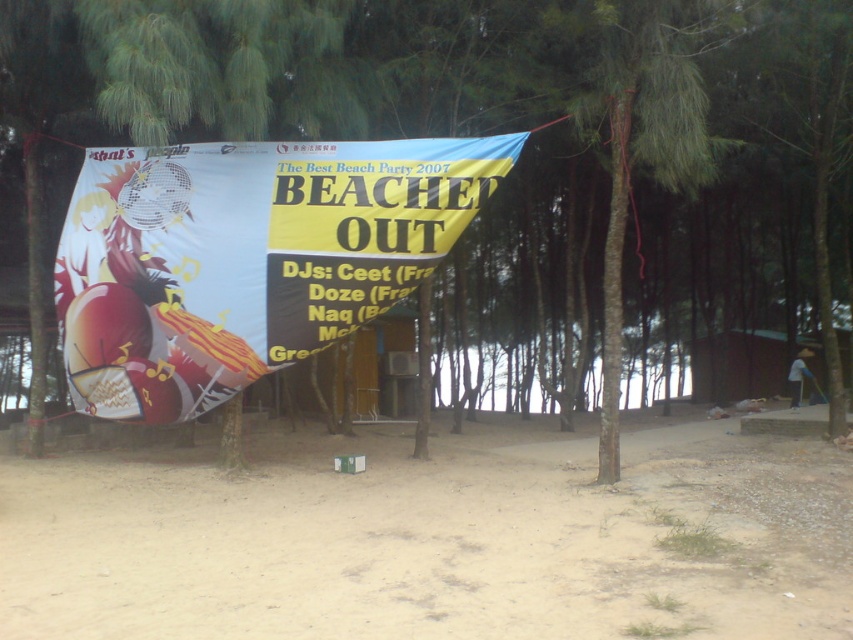
In the scene shown: Which of these two, sandy brown dirt at lower center or white glossy banner at center, stands taller?

white glossy banner at center is taller.

Does sandy brown dirt at lower center appear on the right side of white glossy banner at center?

Yes, sandy brown dirt at lower center is to the right of white glossy banner at center.

Is point (30, 536) more distant than point (352, 285)?

No, (30, 536) is closer to viewer.

This screenshot has width=853, height=640. Find the location of `sandy brown dirt at lower center`. sandy brown dirt at lower center is located at coordinates pyautogui.click(x=436, y=541).